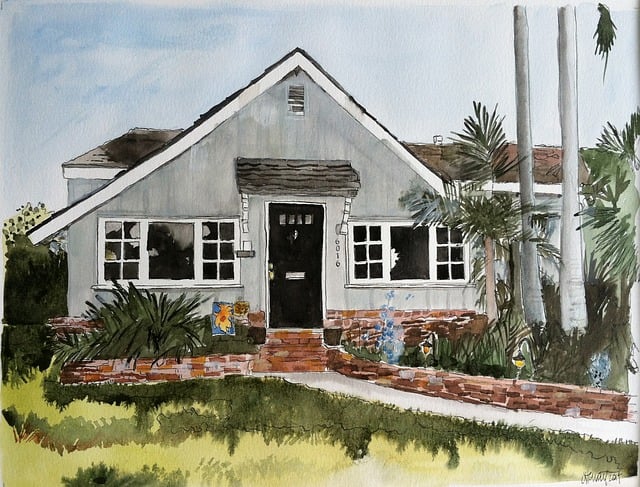
At what (x,y) coordinates should I click in order to perform the action: click on window. Please return your answer as a coordinate pair (x, y). Looking at the image, I should click on 169,255, 411,249, 456,256, 367,252, 220,255, 118,237.